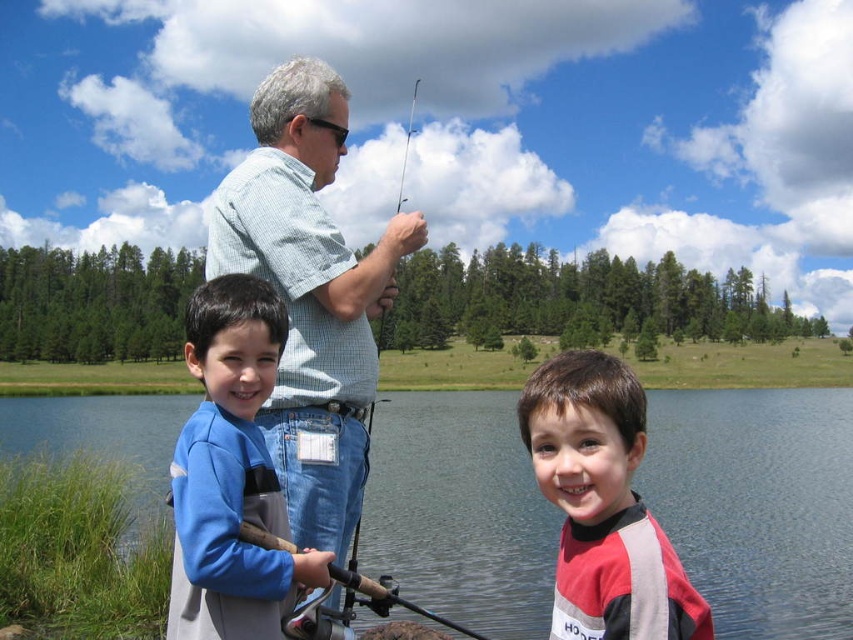
Question: Where is blue water at center located in relation to blue fleece jacket at left in the image?

Choices:
 (A) right
 (B) left

Answer: (A)

Question: Is the position of light blue checkered shirt at center less distant than that of red and gray wetsuit at center?

Choices:
 (A) yes
 (B) no

Answer: (B)

Question: Which point is closer to the camera?

Choices:
 (A) (381, 413)
 (B) (326, 580)
 (C) (547, 449)
 (D) (323, 417)

Answer: (C)

Question: Among these points, which one is farthest from the camera?

Choices:
 (A) (221, 182)
 (B) (48, 397)

Answer: (B)

Question: Observing the image, what is the correct spatial positioning of light blue checkered shirt at center in reference to blue fleece jacket at left?

Choices:
 (A) right
 (B) left

Answer: (A)

Question: Estimate the real-world distances between objects in this image. Which object is closer to the red and gray wetsuit at center?

Choices:
 (A) blue water at center
 (B) light blue checkered shirt at center

Answer: (B)